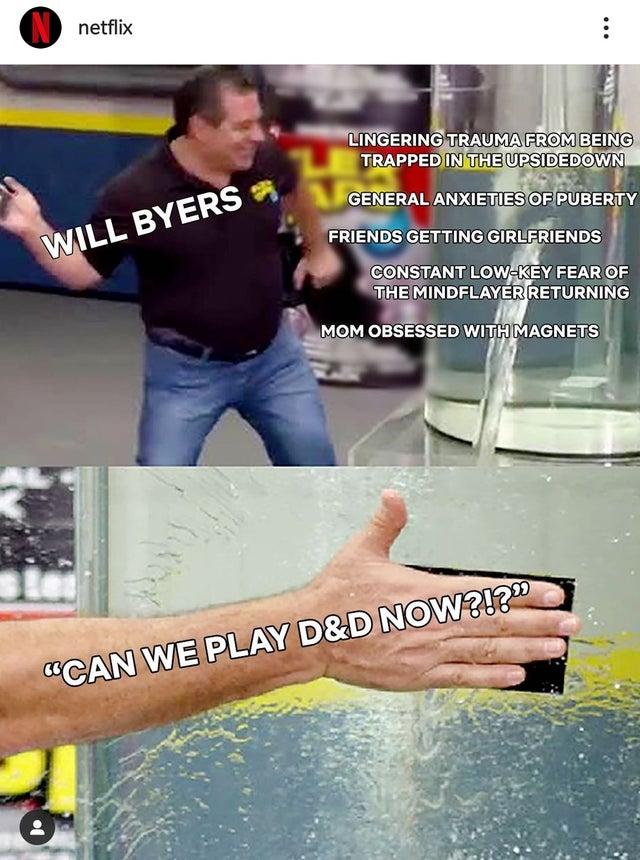
Find the location of a particular element. floor is located at coordinates (70, 397).